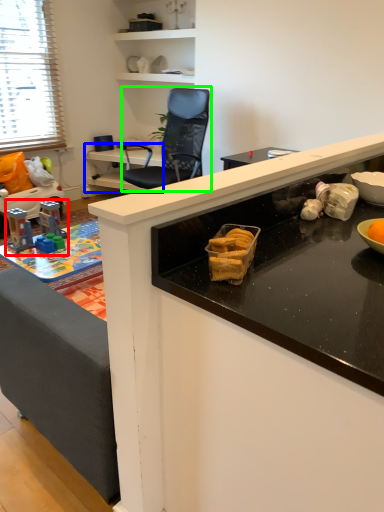
Question: Based on their relative distances, which object is farther from toy (highlighted by a red box)? Choose from table (highlighted by a blue box) and chair (highlighted by a green box).

Choices:
 (A) table
 (B) chair

Answer: (A)